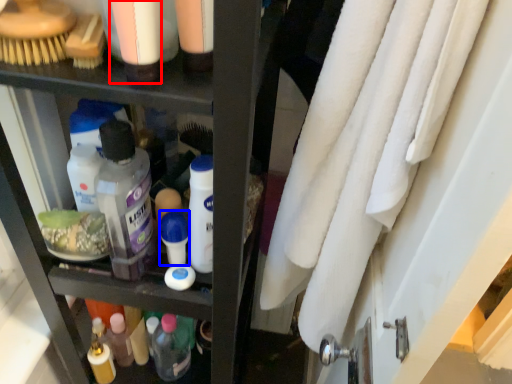
Question: Which object appears farthest to the camera in this image, toiletry (highlighted by a red box) or toiletry (highlighted by a blue box)?

Choices:
 (A) toiletry
 (B) toiletry

Answer: (B)